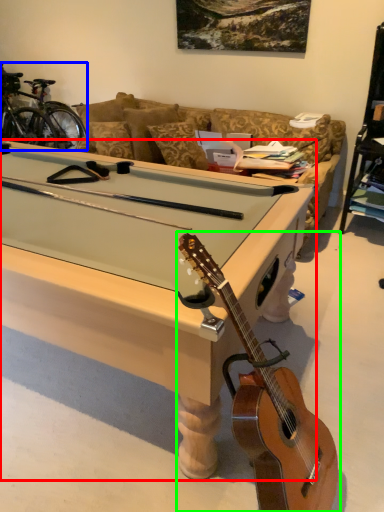
Question: Which object is the closest to the desk (highlighted by a red box)? Choose among these: bicycle (highlighted by a blue box) or guitar (highlighted by a green box).

Choices:
 (A) bicycle
 (B) guitar

Answer: (B)